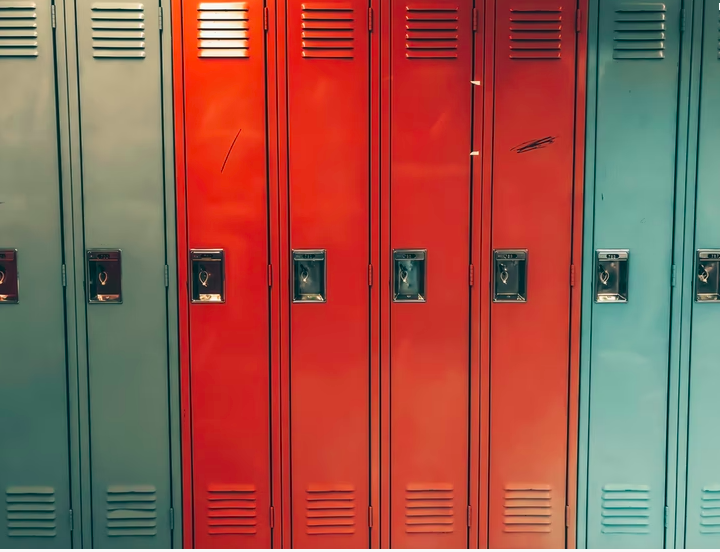
Identify the location of lockers. (440, 238).